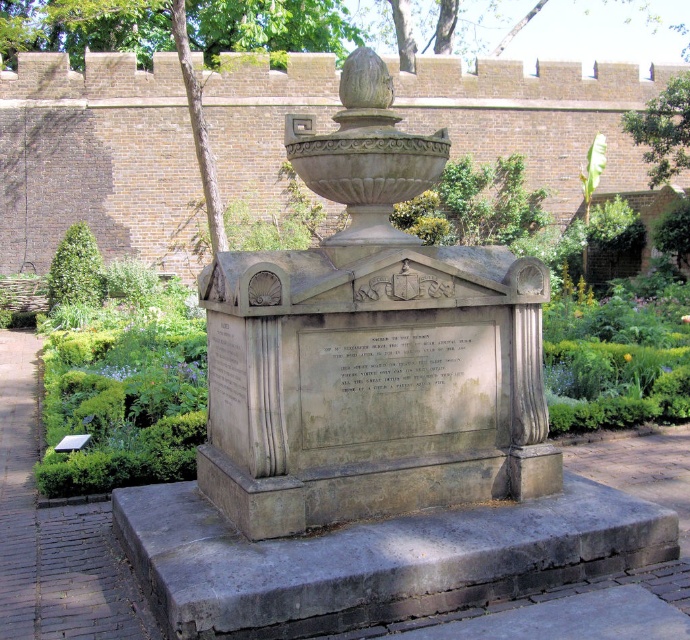
Can you confirm if gray stone monument at center is positioned to the right of green leafy tree at upper right?

Incorrect, gray stone monument at center is not on the right side of green leafy tree at upper right.

From the picture: Which is below, gray stone monument at center or green leafy tree at upper right?

gray stone monument at center is below.

Is point (433, 355) positioned before point (667, 124)?

Yes, point (433, 355) is closer to viewer.

Where is `gray stone monument at center`? gray stone monument at center is located at coordinates (371, 348).